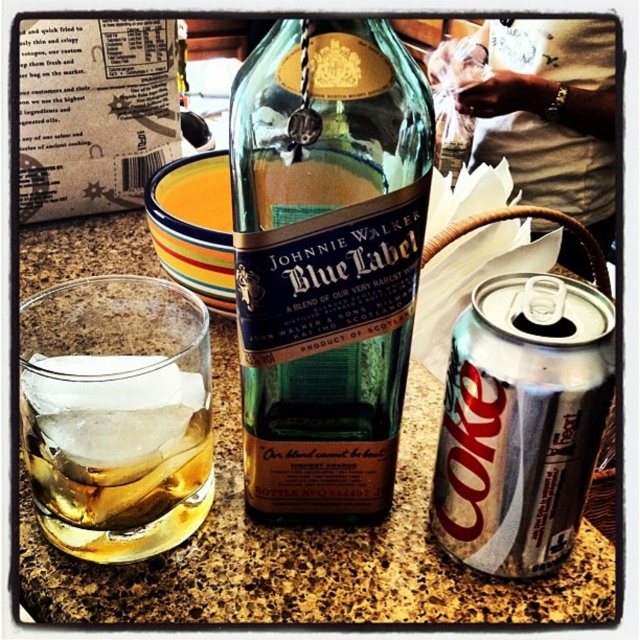
Question: Which point appears closest to the camera in this image?

Choices:
 (A) (252, 296)
 (B) (483, 433)

Answer: (A)

Question: Does green glass bottle at center appear on the right side of silver metallic can at right?

Choices:
 (A) yes
 (B) no

Answer: (B)

Question: Does translucent glass at lower left appear over silver metallic can at right?

Choices:
 (A) no
 (B) yes

Answer: (B)

Question: Does translucent glass at lower left have a greater width compared to silver metallic can at right?

Choices:
 (A) no
 (B) yes

Answer: (B)

Question: Considering the real-world distances, which object is closest to the green glass bottle at center?

Choices:
 (A) silver metallic can at right
 (B) translucent glass at lower left

Answer: (A)

Question: Which point appears closest to the camera in this image?

Choices:
 (A) (576, 528)
 (B) (83, 445)

Answer: (B)